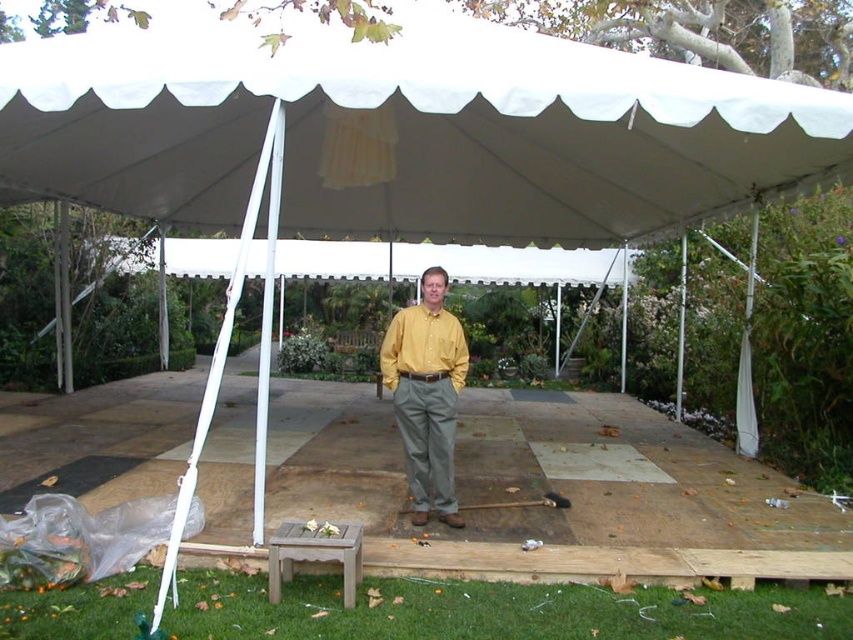
Is yellow matte shirt at center closer to the viewer compared to teak wood stool at lower center?

That is False.

Does yellow matte shirt at center appear under teak wood stool at lower center?

Incorrect, yellow matte shirt at center is not positioned below teak wood stool at lower center.

Who is more forward, (416,460) or (282,564)?

Point (282,564) is in front.

Where is `yellow matte shirt at center`? The width and height of the screenshot is (853, 640). yellow matte shirt at center is located at coordinates (426, 394).